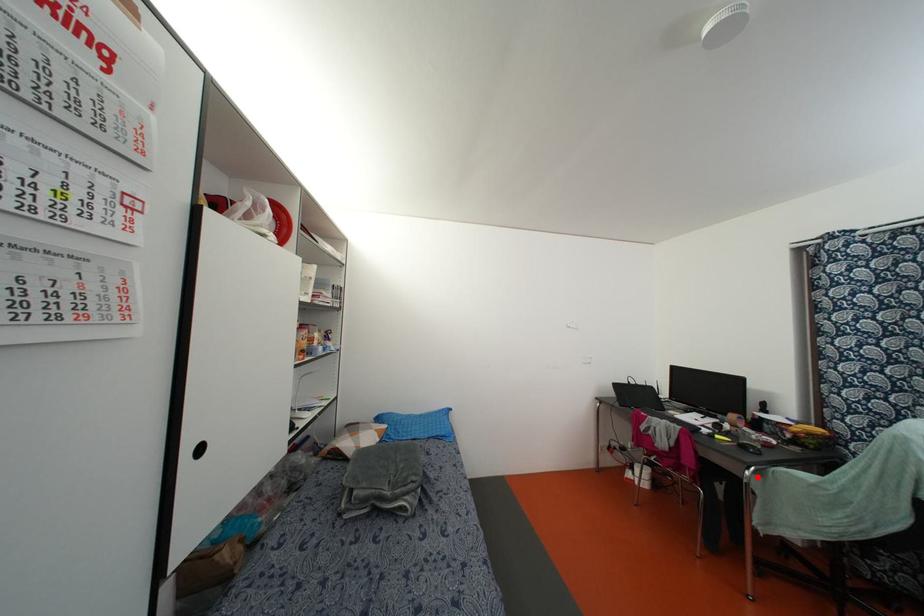
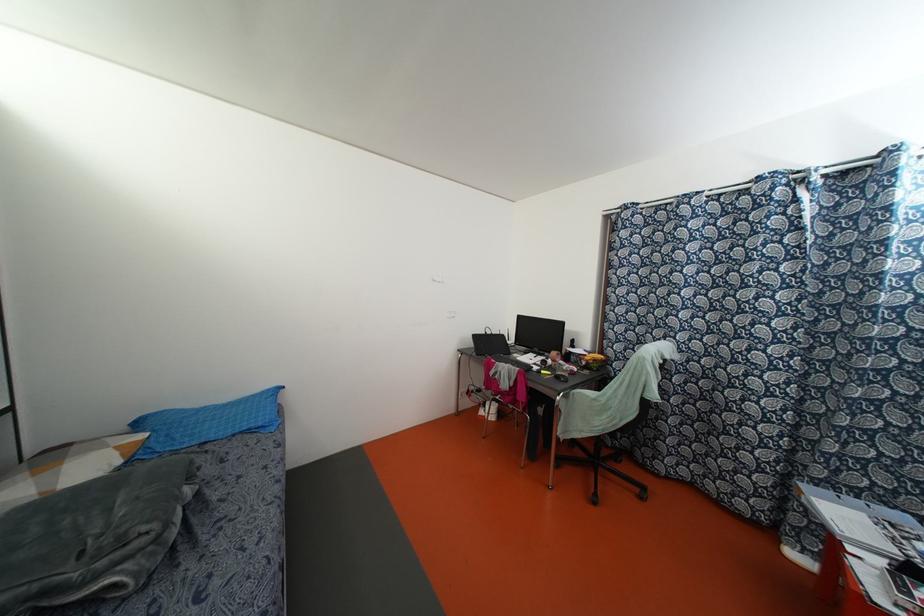
Locate, in the second image, the point that corresponds to the highlighted location in the first image.

(564, 399)